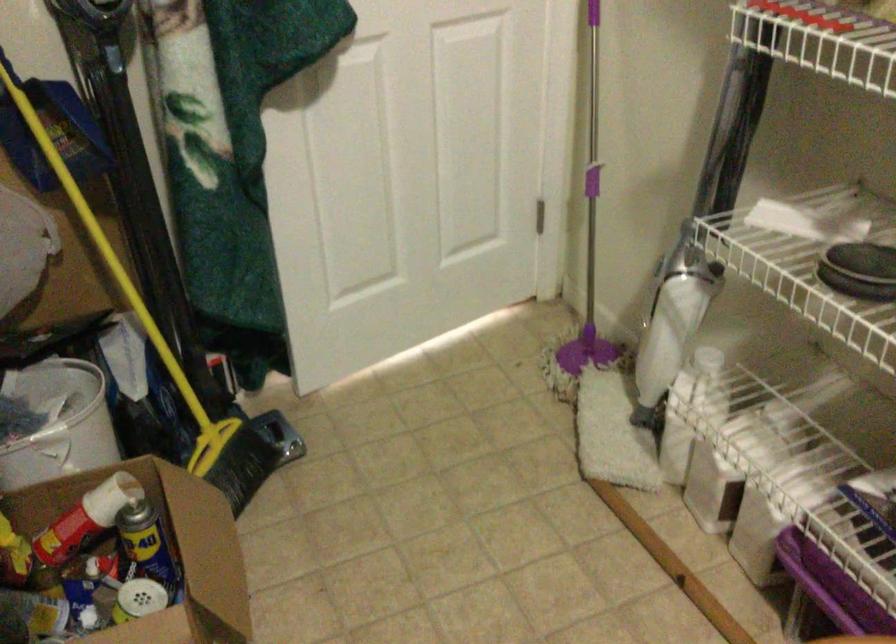
What do you see at coordinates (135, 140) in the screenshot?
I see `the yellow broom handle` at bounding box center [135, 140].